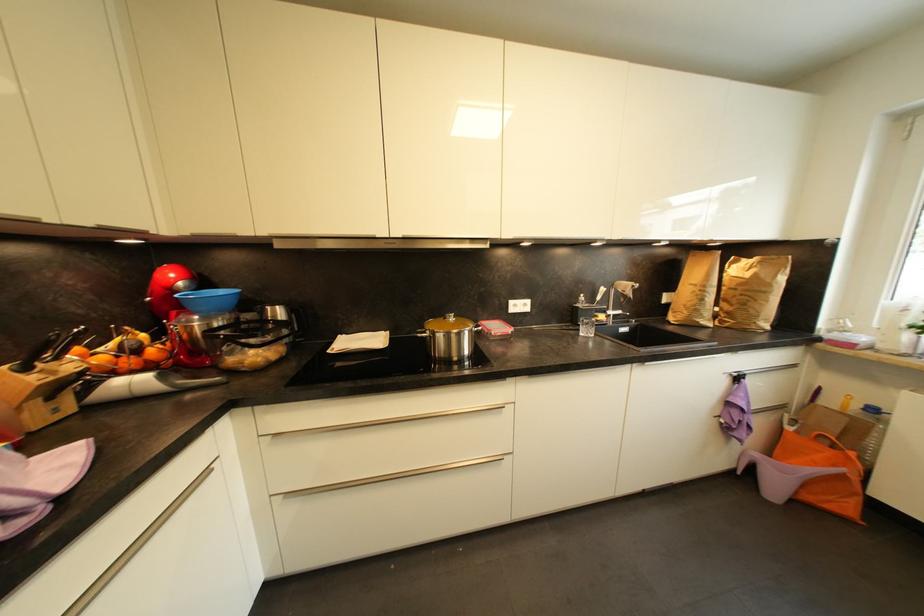
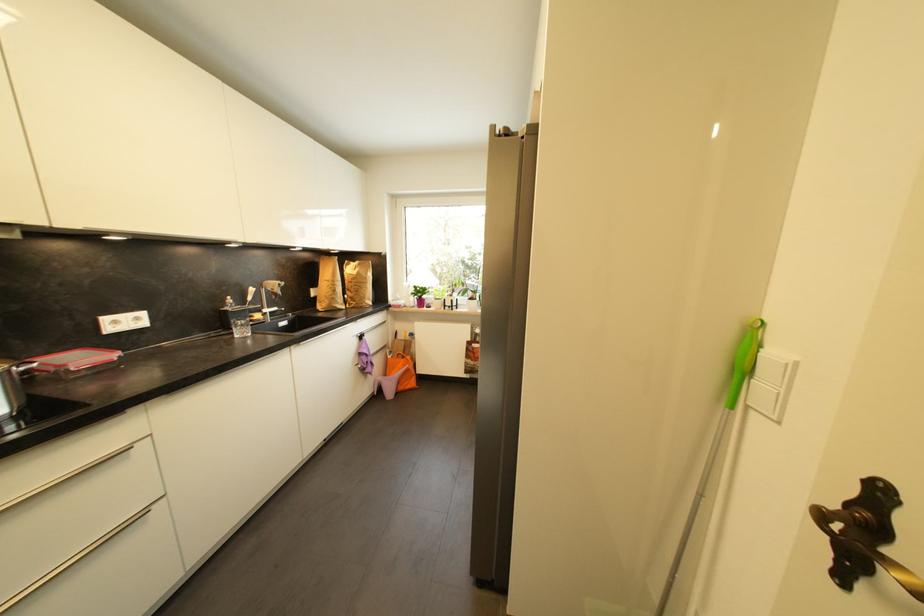
Locate, in the second image, the point that corresponds to point (795, 430) in the first image.

(395, 359)